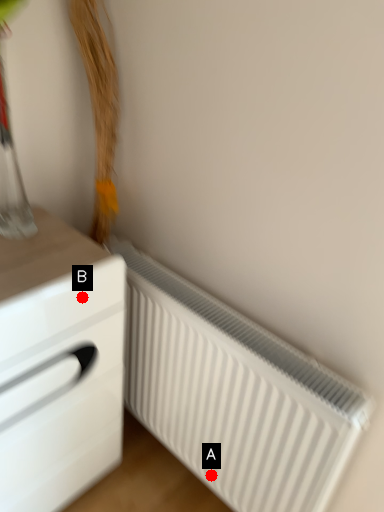
Question: Two points are circled on the image, labeled by A and B beside each circle. Among these points, which one is farthest from the camera?

Choices:
 (A) A is further
 (B) B is further

Answer: (A)